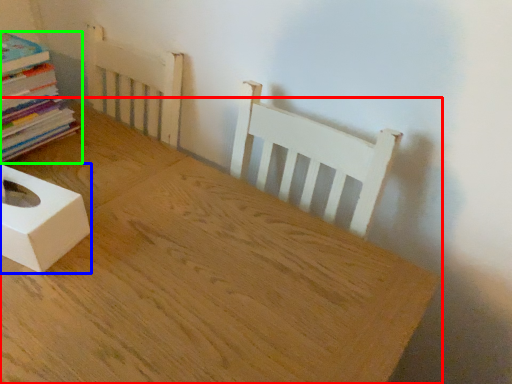
Question: Based on their relative distances, which object is nearer to table (highlighted by a red box)? Choose from box (highlighted by a blue box) and book (highlighted by a green box).

Choices:
 (A) box
 (B) book

Answer: (A)